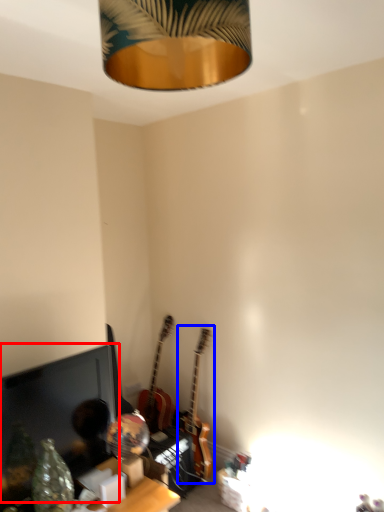
Question: Which point is closer to the camera, computer monitor (highlighted by a red box) or guitar (highlighted by a blue box)?

Choices:
 (A) computer monitor
 (B) guitar

Answer: (A)